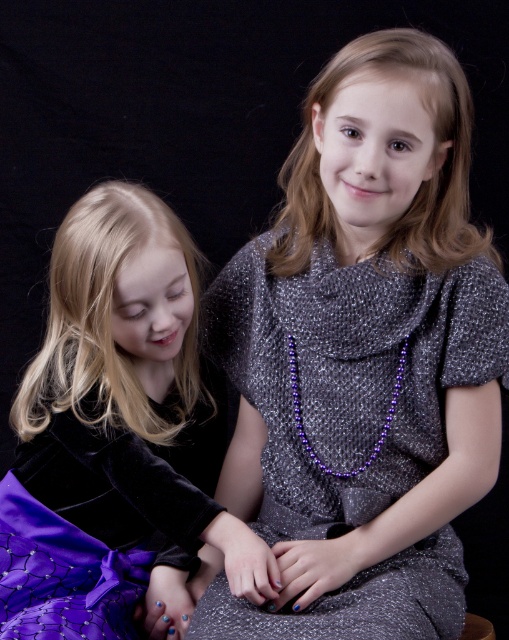
Question: Which of the following is the closest to the observer?

Choices:
 (A) sparkly silver dress at center
 (B) purple velvet skirt at lower left

Answer: (A)

Question: Which object is closer to the camera taking this photo?

Choices:
 (A) purple velvet skirt at lower left
 (B) sparkly silver dress at center

Answer: (B)

Question: Is sparkly silver dress at center in front of purple velvet skirt at lower left?

Choices:
 (A) yes
 (B) no

Answer: (A)

Question: Does sparkly silver dress at center appear on the left side of purple velvet skirt at lower left?

Choices:
 (A) yes
 (B) no

Answer: (B)

Question: From the image, what is the correct spatial relationship of sparkly silver dress at center in relation to purple velvet skirt at lower left?

Choices:
 (A) above
 (B) below

Answer: (A)